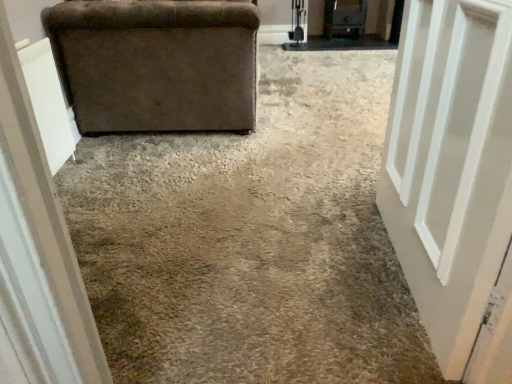
Question: Would you say brown fabric couch at upper left is outside velvet brown armchair at left?

Choices:
 (A) yes
 (B) no

Answer: (A)

Question: Would you say brown fabric couch at upper left contains velvet brown armchair at left?

Choices:
 (A) yes
 (B) no

Answer: (B)

Question: Is there a large distance between brown fabric couch at upper left and velvet brown armchair at left?

Choices:
 (A) no
 (B) yes

Answer: (A)

Question: Is brown fabric couch at upper left in front of velvet brown armchair at left?

Choices:
 (A) no
 (B) yes

Answer: (B)

Question: From a real-world perspective, is brown fabric couch at upper left below velvet brown armchair at left?

Choices:
 (A) no
 (B) yes

Answer: (B)

Question: From a real-world perspective, is brown fabric couch at upper left above or below velvet brown armchair at left?

Choices:
 (A) below
 (B) above

Answer: (A)

Question: Relative to velvet brown armchair at left, is brown fabric couch at upper left in front or behind?

Choices:
 (A) front
 (B) behind

Answer: (A)

Question: Is brown fabric couch at upper left inside or outside of velvet brown armchair at left?

Choices:
 (A) outside
 (B) inside

Answer: (A)

Question: From the image's perspective, is brown fabric couch at upper left located above or below velvet brown armchair at left?

Choices:
 (A) above
 (B) below

Answer: (B)

Question: Considering the positions of white painted wood door at right and brown fabric couch at upper left in the image, is white painted wood door at right bigger or smaller than brown fabric couch at upper left?

Choices:
 (A) small
 (B) big

Answer: (A)

Question: Is white painted wood door at right taller or shorter than brown fabric couch at upper left?

Choices:
 (A) short
 (B) tall

Answer: (B)

Question: Visually, is white painted wood door at right positioned to the left or to the right of brown fabric couch at upper left?

Choices:
 (A) right
 (B) left

Answer: (A)

Question: Is white painted wood door at right situated inside brown fabric couch at upper left or outside?

Choices:
 (A) outside
 (B) inside

Answer: (A)

Question: Is brown fabric couch at upper left inside the boundaries of white painted wood door at right, or outside?

Choices:
 (A) outside
 (B) inside

Answer: (A)

Question: From a real-world perspective, relative to white painted wood door at right, is brown fabric couch at upper left vertically above or below?

Choices:
 (A) below
 (B) above

Answer: (A)